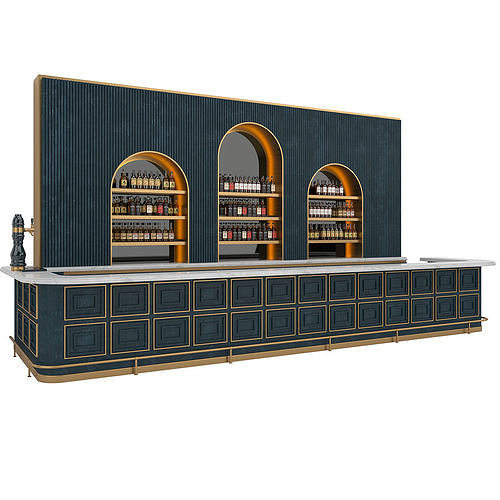
The width and height of the screenshot is (500, 500). Identify the location of concave shelf area, upper right sie. (342, 179).